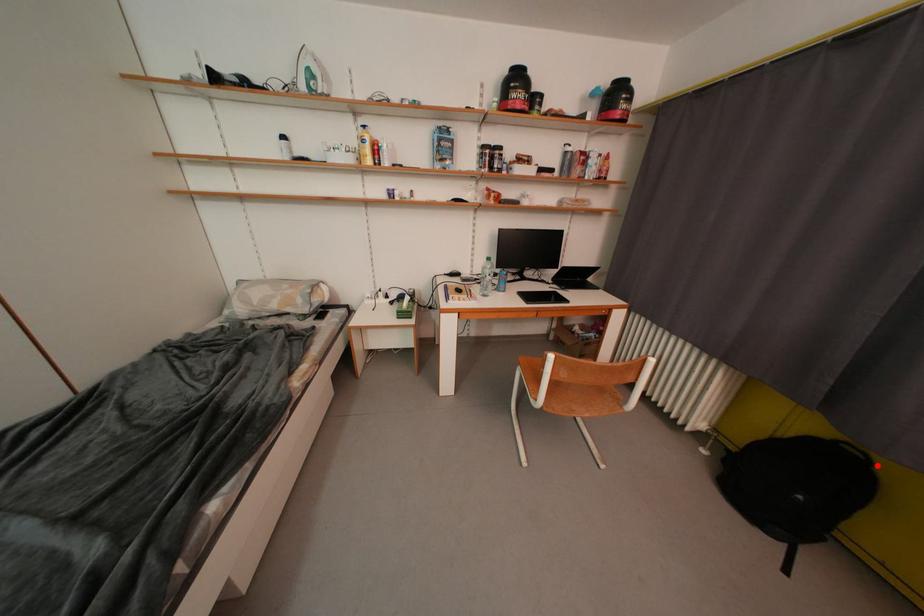
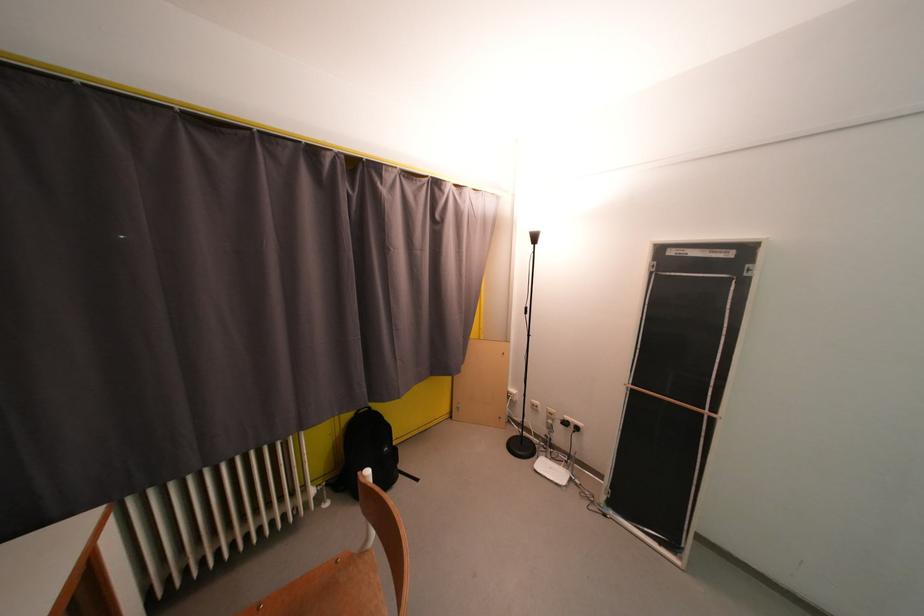
Find the pixel in the second image that matches the highlighted location in the first image.

(378, 411)